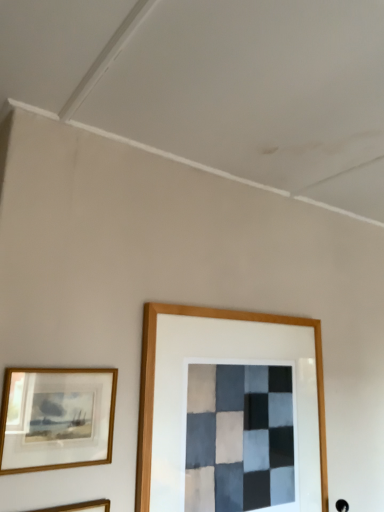
What do you see at coordinates (56, 418) in the screenshot? This screenshot has width=384, height=512. I see `matte gold picture frame at lower left` at bounding box center [56, 418].

You are a GUI agent. You are given a task and a screenshot of the screen. Output one action in this format:
    pyautogui.click(x=<x>, y=<y>)
    Task: Click on the matte gold picture frame at lower left
    
    Given the screenshot: What is the action you would take?
    pyautogui.click(x=56, y=418)

This screenshot has height=512, width=384. What are the coordinates of `matte gold picture frame at lower left` in the screenshot? It's located at (56, 418).